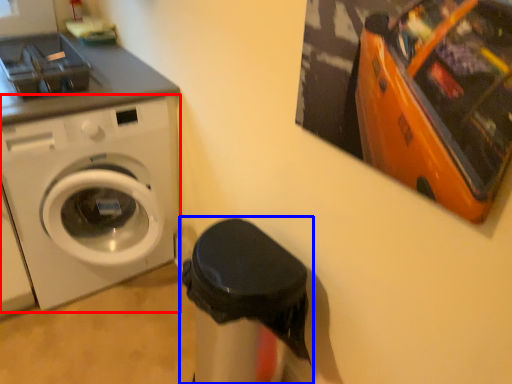
Question: Which object is closer to the camera taking this photo, washing machine (highlighted by a red box) or garbage (highlighted by a blue box)?

Choices:
 (A) washing machine
 (B) garbage

Answer: (B)